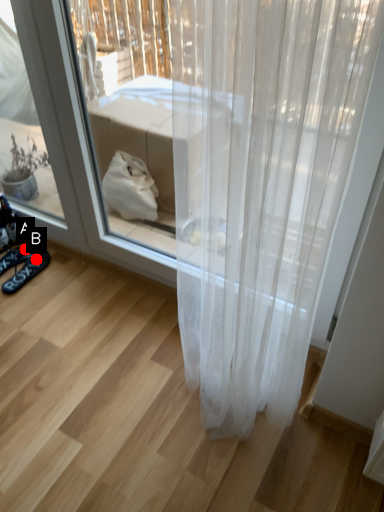
Question: Two points are circled on the image, labeled by A and B beside each circle. Which point is further to the camera?

Choices:
 (A) A is further
 (B) B is further

Answer: (A)